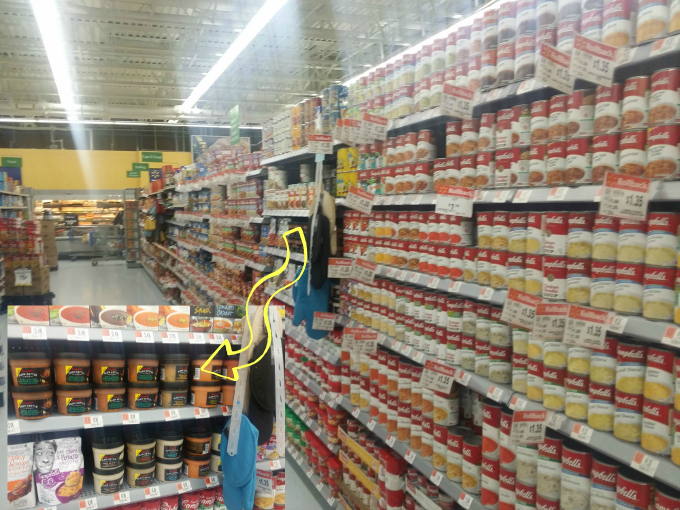
I want to click on floor, so click(x=85, y=284).